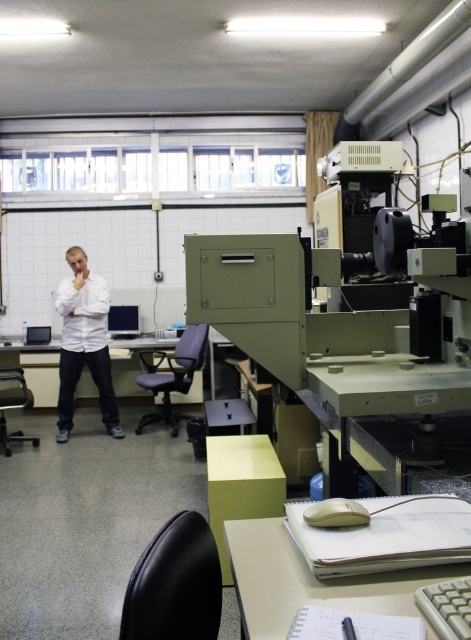
Question: Considering the relative positions of matte white table at left and matte black monitor at center in the image provided, where is matte white table at left located with respect to matte black monitor at center?

Choices:
 (A) below
 (B) above

Answer: (A)

Question: Which point appears farthest from the camera in this image?

Choices:
 (A) (307, 589)
 (B) (131, 333)
 (C) (73, 262)

Answer: (B)

Question: Can you confirm if white matte shirt at center is positioned to the right of matte black monitor at center?

Choices:
 (A) no
 (B) yes

Answer: (A)

Question: Which is nearer to the matte plastic table at lower center?

Choices:
 (A) matte white table at left
 (B) matte black monitor at center

Answer: (A)

Question: Which object is farther from the camera taking this photo?

Choices:
 (A) matte white table at left
 (B) white matte shirt at center
 (C) matte black monitor at center
 (D) matte plastic table at lower center

Answer: (C)

Question: Does white matte shirt at center appear on the right side of matte black monitor at center?

Choices:
 (A) yes
 (B) no

Answer: (B)